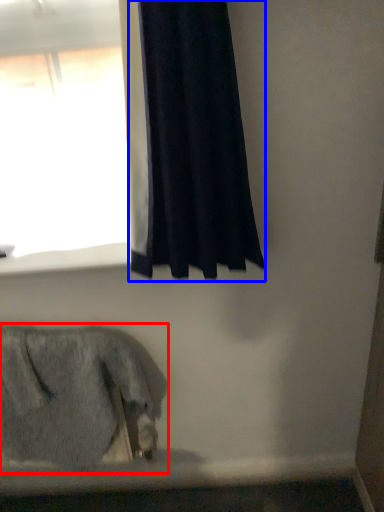
Question: Which object appears closest to the camera in this image, animal (highlighted by a red box) or curtain (highlighted by a blue box)?

Choices:
 (A) animal
 (B) curtain

Answer: (B)